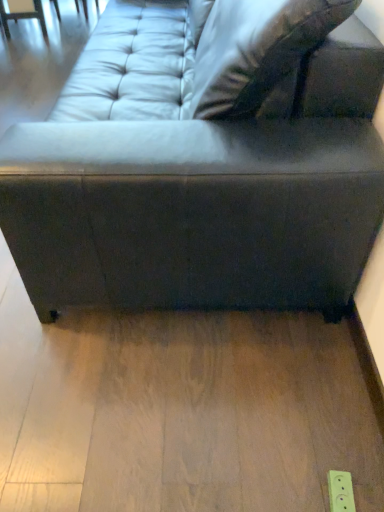
In order to click on matte gray couch at center in this screenshot , I will do `click(203, 201)`.

The width and height of the screenshot is (384, 512). Describe the element at coordinates (203, 201) in the screenshot. I see `matte gray couch at center` at that location.

The width and height of the screenshot is (384, 512). In order to click on matte gray couch at center in this screenshot , I will do point(203,201).